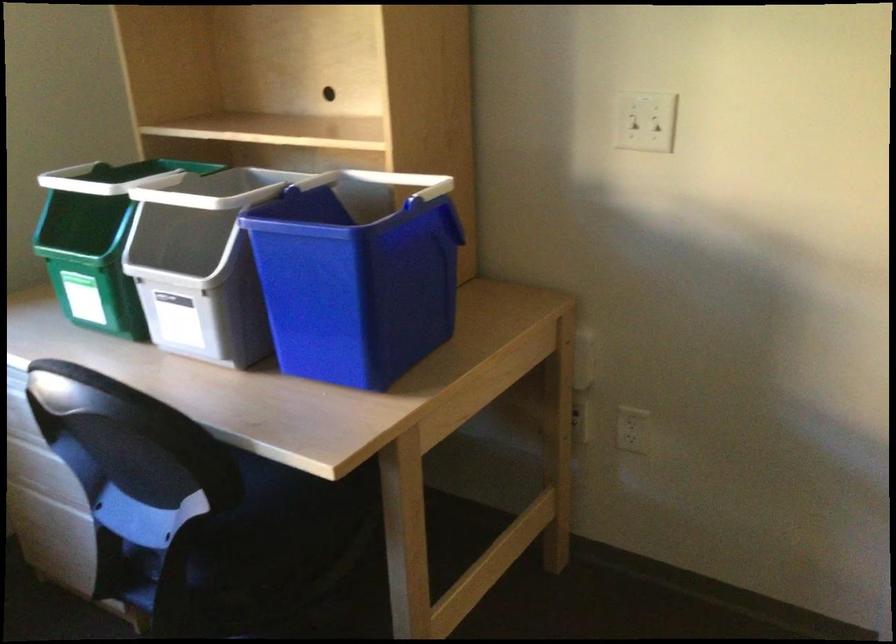
This screenshot has height=644, width=896. What are the coordinates of `blue bin handle` in the screenshot? It's located at (399, 181).